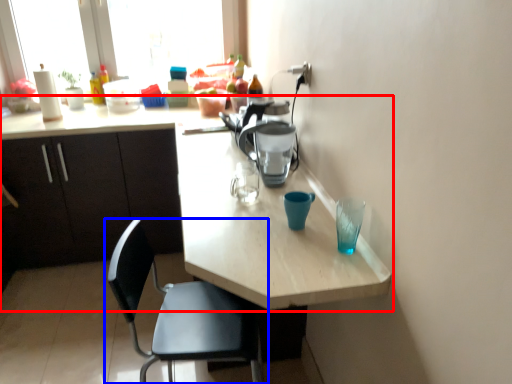
Question: Which object is further to the camera taking this photo, kitchen & dining room table (highlighted by a red box) or chair (highlighted by a blue box)?

Choices:
 (A) kitchen & dining room table
 (B) chair

Answer: (B)